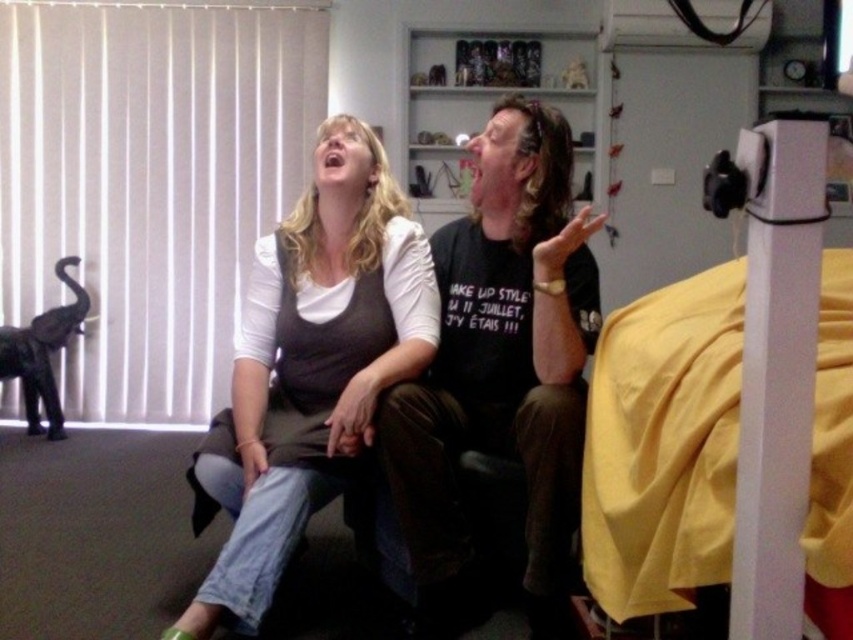
Between yellow fabric bed at right and matte brown vest at center, which one is positioned higher?

Positioned higher is yellow fabric bed at right.

Consider the image. Does yellow fabric bed at right have a larger size compared to matte brown vest at center?

Incorrect, yellow fabric bed at right is not larger than matte brown vest at center.

Who is more forward, (584,504) or (311,202)?

Point (584,504) is in front.

At what (x,y) coordinates should I click in order to perform the action: click on yellow fabric bed at right. Please return your answer as a coordinate pair (x, y). Looking at the image, I should click on (721, 400).

Is point (776, 132) closer to viewer compared to point (505, 436)?

That is True.

Locate an element on the screen. Image resolution: width=853 pixels, height=640 pixels. yellow fabric bed at right is located at coordinates (721, 400).

Is black cotton t-shirt at center wider than matte brown vest at center?

No.

Which is more to the left, black cotton t-shirt at center or matte brown vest at center?

Positioned to the left is matte brown vest at center.

Consider the image. Measure the distance between point (x=469, y=320) and camera.

Point (x=469, y=320) and camera are 1.99 meters apart.

Identify the location of black cotton t-shirt at center. (500, 365).